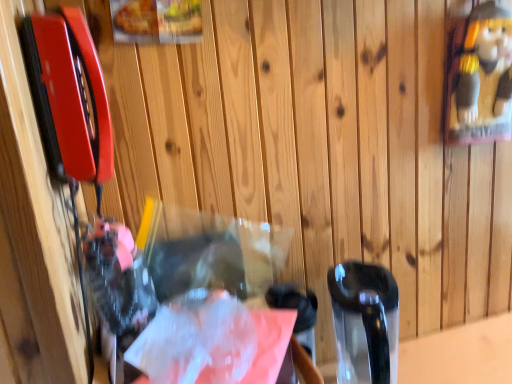
This screenshot has height=384, width=512. What do you see at coordinates (212, 342) in the screenshot?
I see `translucent plastic bag at center` at bounding box center [212, 342].

You are a GUI agent. You are given a task and a screenshot of the screen. Output one action in this format:
    pyautogui.click(x=<x>, y=<y>)
    Task: Click on the translucent plastic bag at center
    Image resolution: width=512 pixels, height=384 pixels.
    Given the screenshot: What is the action you would take?
    click(212, 342)

Identify the location of translucent plastic bag at center. This screenshot has width=512, height=384. (185, 261).

Describe the element at coordinates (185, 261) in the screenshot. I see `translucent plastic bag at center` at that location.

The image size is (512, 384). I want to click on translucent plastic bag at center, so click(x=212, y=342).

Can you confirm if translucent plastic bag at center is positioned to the right of translucent plastic bag at center?

Indeed, translucent plastic bag at center is positioned on the right side of translucent plastic bag at center.

Is translucent plastic bag at center positioned behind translucent plastic bag at center?

Yes, translucent plastic bag at center is behind translucent plastic bag at center.

Is point (214, 308) closer or farther from the camera than point (117, 236)?

Clearly, point (214, 308) is more distant from the camera than point (117, 236).

From the image's perspective, between translucent plastic bag at center and translucent plastic bag at center, who is located below?

translucent plastic bag at center is shown below in the image.

From a real-world perspective, which is physically above, translucent plastic bag at center or translucent plastic bag at center?

translucent plastic bag at center, from a real-world perspective.

Can you confirm if translucent plastic bag at center is wider than translucent plastic bag at center?

Incorrect, the width of translucent plastic bag at center does not surpass that of translucent plastic bag at center.

Considering the sizes of objects translucent plastic bag at center and translucent plastic bag at center in the image provided, who is shorter, translucent plastic bag at center or translucent plastic bag at center?

translucent plastic bag at center is shorter.

Between translucent plastic bag at center and translucent plastic bag at center, which one has larger size?

Bigger between the two is translucent plastic bag at center.

In the scene shown: Is translucent plastic bag at center spatially inside translucent plastic bag at center, or outside of it?

translucent plastic bag at center is not inside translucent plastic bag at center, it's outside.

Are translucent plastic bag at center and translucent plastic bag at center making contact?

Yes, translucent plastic bag at center is with translucent plastic bag at center.

Is translucent plastic bag at center positioned with its back to translucent plastic bag at center?

That's not correct — translucent plastic bag at center is not looking away from translucent plastic bag at center.

Find the location of a particular element. waste in front of the translucent plastic bag at center is located at coordinates (185, 261).

Considering the positions of objects translucent plastic bag at center and translucent plastic bag at center in the image provided, who is more to the right, translucent plastic bag at center or translucent plastic bag at center?

From the viewer's perspective, translucent plastic bag at center appears more on the right side.

Who is more distant, translucent plastic bag at center or translucent plastic bag at center?

translucent plastic bag at center is behind.

Which is further, (160, 270) or (225, 296)?

Point (225, 296)

From the image's perspective, is translucent plastic bag at center above or below translucent plastic bag at center?

From the image's perspective, translucent plastic bag at center appears below translucent plastic bag at center.

From a real-world perspective, is translucent plastic bag at center on translucent plastic bag at center?

No, from a real-world perspective, translucent plastic bag at center is not above translucent plastic bag at center.

Is translucent plastic bag at center thinner than translucent plastic bag at center?

No, translucent plastic bag at center is not thinner than translucent plastic bag at center.

Who is taller, translucent plastic bag at center or translucent plastic bag at center?

With more height is translucent plastic bag at center.

Between translucent plastic bag at center and translucent plastic bag at center, which one has larger size?

translucent plastic bag at center is bigger.

Is translucent plastic bag at center surrounded by translucent plastic bag at center?

Actually, translucent plastic bag at center is outside translucent plastic bag at center.

Is translucent plastic bag at center far from translucent plastic bag at center?

They are positioned close to each other.

Is translucent plastic bag at center facing away from translucent plastic bag at center?

No.

How different are the orientations of translucent plastic bag at center and translucent plastic bag at center in degrees?

The angle between the facing direction of translucent plastic bag at center and the facing direction of translucent plastic bag at center is 7.13 degrees.

Measure the distance between translucent plastic bag at center and translucent plastic bag at center.

translucent plastic bag at center and translucent plastic bag at center are 3.11 inches apart.

Locate an element on the screen. This screenshot has width=512, height=384. wrapping paper that appears behind the translucent plastic bag at center is located at coordinates (212, 342).

I want to click on wrapping paper above the translucent plastic bag at center (from the image's perspective), so click(212, 342).

Locate an element on the screen. The image size is (512, 384). wrapping paper that appears behind the translucent plastic bag at center is located at coordinates (212, 342).